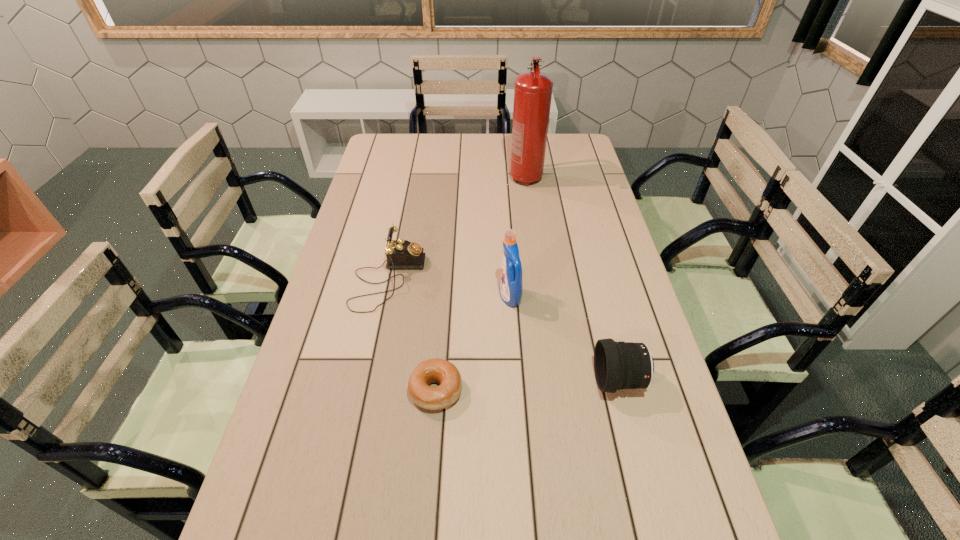
Image resolution: width=960 pixels, height=540 pixels. Identify the location of the tallest object. (533, 90).

Locate an element on the screen. Image resolution: width=960 pixels, height=540 pixels. the farthest object is located at coordinates (533, 90).

What are the coordinates of `detergent` in the screenshot? It's located at (511, 285).

The image size is (960, 540). I want to click on the rightmost object, so click(617, 365).

This screenshot has width=960, height=540. Identify the location of the leftmost object. (401, 254).

I want to click on the second object from left to right, so click(x=445, y=373).

Where is `the shortest object`? This screenshot has height=540, width=960. the shortest object is located at coordinates (445, 373).

Image resolution: width=960 pixels, height=540 pixels. I want to click on vacant space located on the handle side the fire extinguisher, so pos(530,210).

Image resolution: width=960 pixels, height=540 pixels. In order to click on free location located on the label of the fourth shortest object in this screenshot , I will do `click(483, 297)`.

You are a GUI agent. You are given a task and a screenshot of the screen. Output one action in this format:
    pyautogui.click(x=<x>, y=<y>)
    Task: Click on the free space located 0.380m on the label of the fourth shortest object
    This screenshot has width=960, height=540.
    Given the screenshot: What is the action you would take?
    pyautogui.click(x=371, y=297)